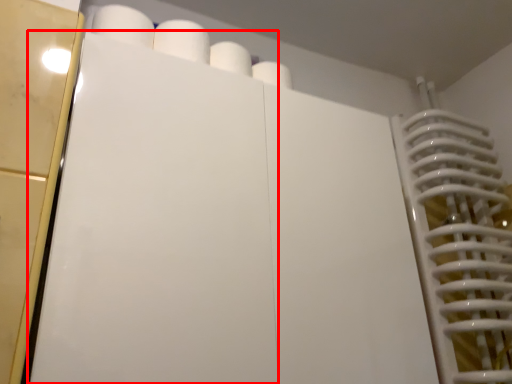
Question: From the image's perspective, what is the correct spatial positioning of door (annotated by the red box) in reference to paper towel?

Choices:
 (A) above
 (B) below

Answer: (B)